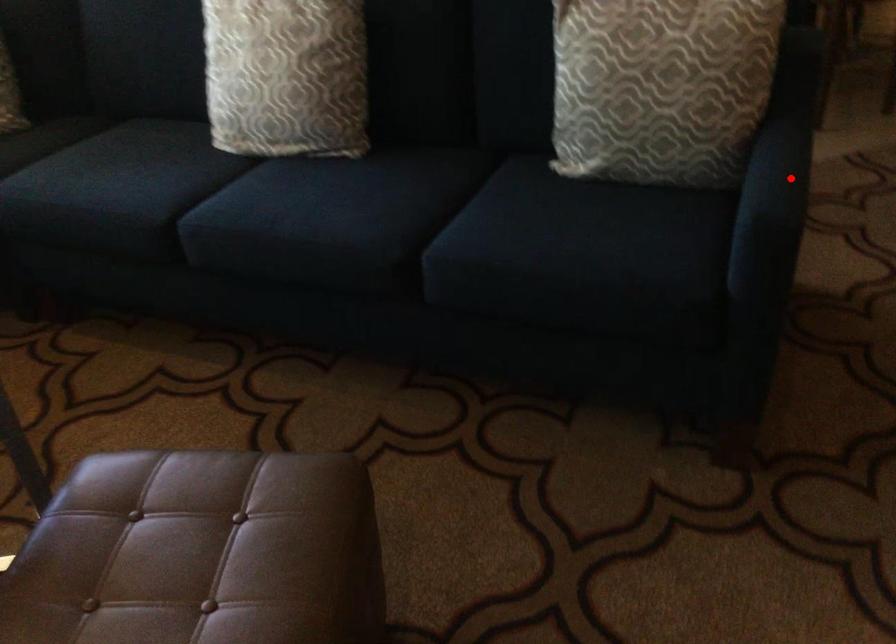
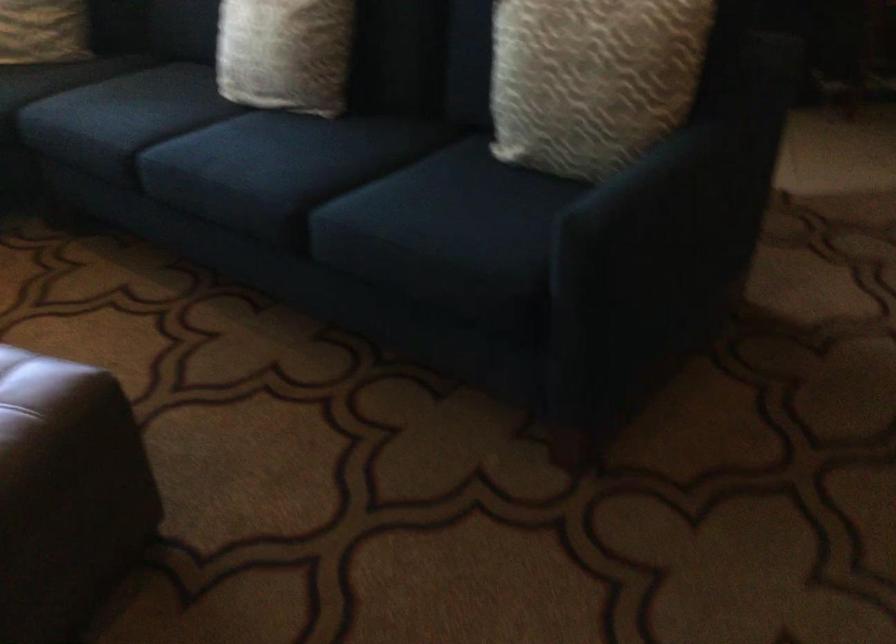
Find the pixel in the second image that matches the highlighted location in the first image.

(687, 190)